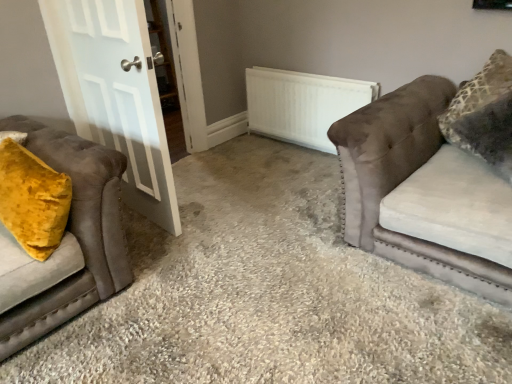
Question: Is velvet brown couch at right, positioned as the second studio couch in left-to-right order, spatially inside velvet mustard pillow at left, marked as the 1th studio couch in a left-to-right arrangement, or outside of it?

Choices:
 (A) outside
 (B) inside

Answer: (A)

Question: From the image's perspective, is velvet brown couch at right, positioned as the second studio couch in left-to-right order, located above or below velvet mustard pillow at left, marked as the 1th studio couch in a left-to-right arrangement?

Choices:
 (A) below
 (B) above

Answer: (B)

Question: Which is farther from the velvet yellow pillow at left?

Choices:
 (A) white glossy door at left
 (B) velvet mustard pillow at left, the 2th studio couch from the right
 (C) velvet brown couch at right, placed as the first studio couch when sorted from right to left
 (D) white matte radiator at center

Answer: (D)

Question: Which is farther from the white glossy door at left?

Choices:
 (A) velvet mustard pillow at left, marked as the 1th studio couch in a left-to-right arrangement
 (B) velvet brown couch at right, positioned as the second studio couch in left-to-right order
 (C) velvet yellow pillow at left
 (D) white matte radiator at center

Answer: (D)